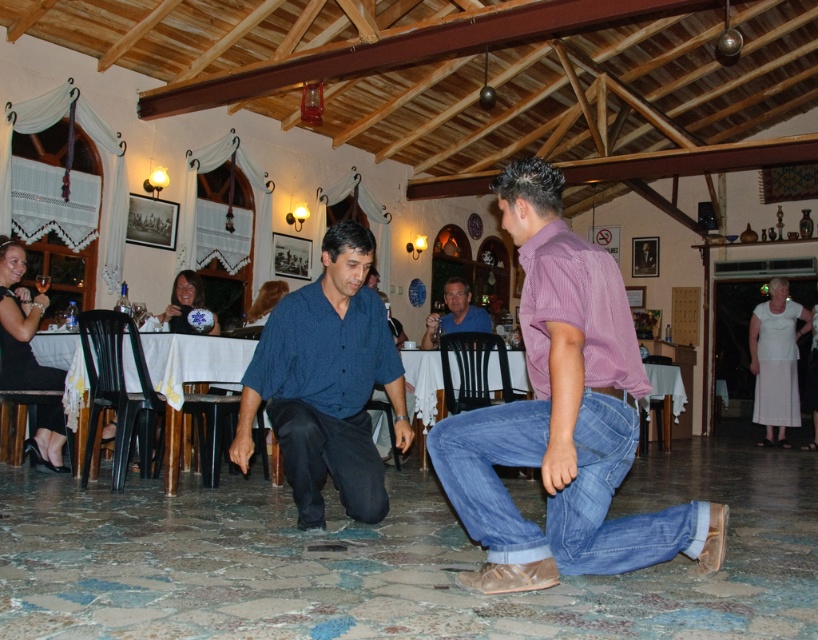
Question: Does pink striped shirt at center have a larger size compared to blue shirt at center?

Choices:
 (A) yes
 (B) no

Answer: (A)

Question: Does pink striped shirt at center come behind blue denim jeans at lower center?

Choices:
 (A) no
 (B) yes

Answer: (A)

Question: Which of the following is the farthest from the observer?

Choices:
 (A) pink striped shirt at center
 (B) dark blue shirt at center

Answer: (B)

Question: Which of the following is the farthest from the observer?

Choices:
 (A) (358, 429)
 (B) (499, 547)
 (C) (578, 314)
 (D) (464, 282)

Answer: (D)

Question: Is pink striped shirt at center closer to camera compared to dark blue denim jeans at center?

Choices:
 (A) yes
 (B) no

Answer: (A)

Question: Among these points, which one is farthest from the camera?

Choices:
 (A) (339, 307)
 (B) (488, 330)
 (C) (542, 376)
 (D) (479, 460)

Answer: (B)